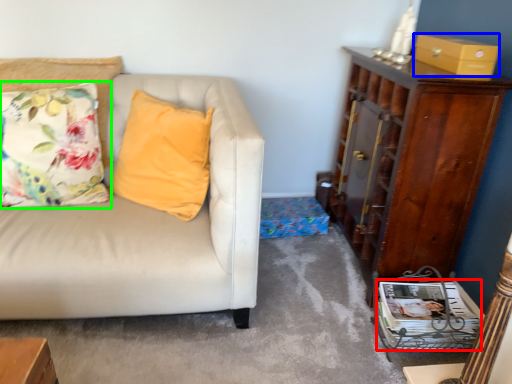
Question: Considering the real-world distances, which object is closest to magazine (highlighted by a red box)? box (highlighted by a blue box) or pillow (highlighted by a green box).

Choices:
 (A) box
 (B) pillow

Answer: (A)